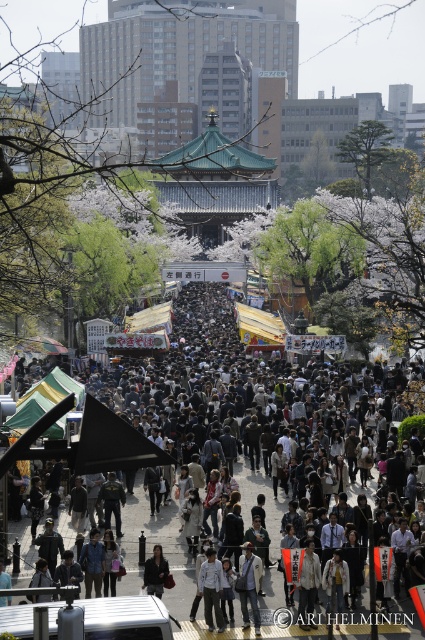
You are a photographer standing in the crowd at the festival. You notice two people wearing light gray fabric jacket at center and dark gray fabric coat at center. Which one is positioned to the right side?

The light gray fabric jacket at center is positioned to the right of the dark gray fabric coat at center.

Based on the photo, you are standing at the entrance of the festival and see the light gray fabric jacket at center. If you walk straight ahead, will the jacket come into your line of sight before reaching the pathway lined with stalls?

The light gray fabric jacket at center is located at point (x=210, y=588), which is further along the pathway. Therefore, walking straight ahead, you will reach the pathway lined with stalls before the jacket comes into your line of sight.